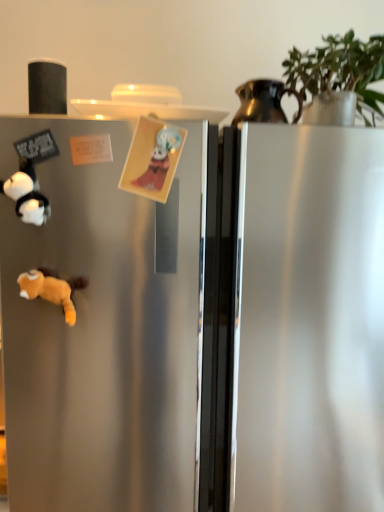
Question: Does matte paper card at center, placed as the 1th toy when sorted from right to left, have a greater width compared to metallic pitcher at upper right?

Choices:
 (A) no
 (B) yes

Answer: (A)

Question: Is matte paper card at center, placed as the 2th toy when sorted from left to right, closer to the viewer compared to metallic pitcher at upper right?

Choices:
 (A) no
 (B) yes

Answer: (B)

Question: Considering the relative positions of matte paper card at center, placed as the 1th toy when sorted from right to left, and metallic pitcher at upper right in the image provided, is matte paper card at center, placed as the 1th toy when sorted from right to left, behind metallic pitcher at upper right?

Choices:
 (A) no
 (B) yes

Answer: (A)

Question: Is matte paper card at center, placed as the 1th toy when sorted from right to left, facing away from metallic pitcher at upper right?

Choices:
 (A) no
 (B) yes

Answer: (A)

Question: Can you see matte paper card at center, placed as the 2th toy when sorted from left to right, touching metallic pitcher at upper right?

Choices:
 (A) no
 (B) yes

Answer: (A)

Question: From the image's perspective, would you say matte paper card at center, placed as the 2th toy when sorted from left to right, is shown under metallic pitcher at upper right?

Choices:
 (A) no
 (B) yes

Answer: (B)

Question: Can you confirm if metallic pitcher at upper right is wider than green matte plant at upper right?

Choices:
 (A) yes
 (B) no

Answer: (B)

Question: From a real-world perspective, is metallic pitcher at upper right under green matte plant at upper right?

Choices:
 (A) no
 (B) yes

Answer: (B)

Question: From the image's perspective, would you say metallic pitcher at upper right is positioned over green matte plant at upper right?

Choices:
 (A) no
 (B) yes

Answer: (A)

Question: Is metallic pitcher at upper right with green matte plant at upper right?

Choices:
 (A) no
 (B) yes

Answer: (A)

Question: Does metallic pitcher at upper right come in front of green matte plant at upper right?

Choices:
 (A) yes
 (B) no

Answer: (B)

Question: Is metallic pitcher at upper right thinner than green matte plant at upper right?

Choices:
 (A) yes
 (B) no

Answer: (A)

Question: Is white plush panda at left, which ranks as the first toy in left-to-right order, next to metallic pitcher at upper right and touching it?

Choices:
 (A) no
 (B) yes

Answer: (A)